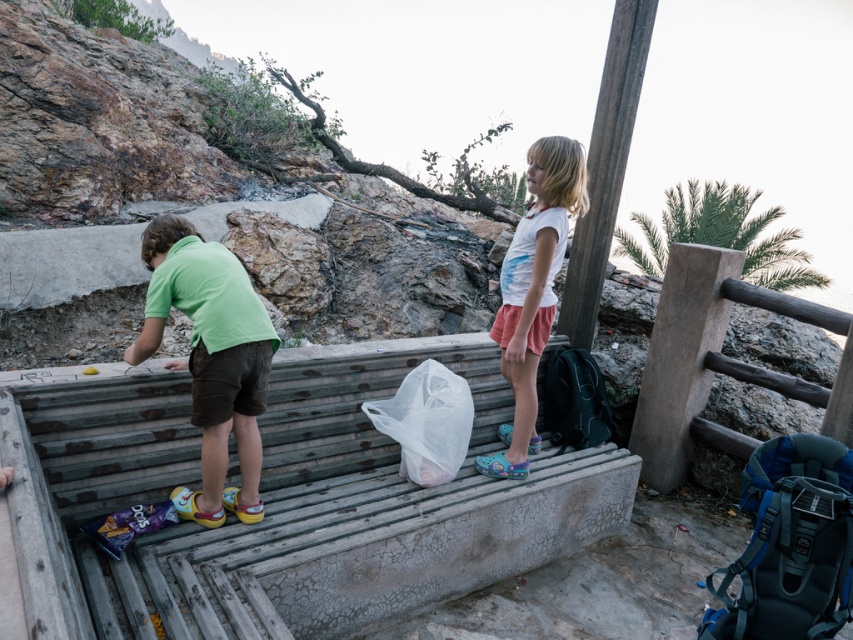
You are a photographer trying to capture a photo of the blue fabric backpack at lower right and the white cotton shirt at center. Which object should you focus on first if you want to include both in the frame without moving the camera?

You should focus on the white cotton shirt at center first because it occupies more space than the blue fabric backpack at lower right, ensuring it fits well within the frame.

You are a photographer trying to capture a photo of both children from your current position. You notice two points marked in the scene. The first point is at coordinate point (824, 564) and the second is at point (560, 365). Which point should you focus on to ensure both children are fully visible in the frame?

You should focus on point (824, 564) because it is in front of point (560, 365), allowing both children to be fully visible in the frame.

You are a photographer trying to capture a photo of the white cotton shirt at center without the blue fabric backpack at lower right appearing in the frame. Is it possible to adjust your position so that the backpack is out of sight while still keeping the shirt in view?

The blue fabric backpack at lower right is below the white cotton shirt at center, so by positioning the camera above the backpack and aiming downward toward the shirt, it can be framed without the backpack obstructing the view.